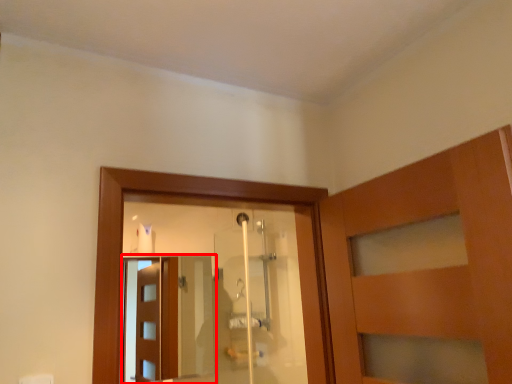
Question: From the image, what is the correct spatial relationship of screen door (annotated by the red box) in relation to shower door?

Choices:
 (A) right
 (B) left

Answer: (B)